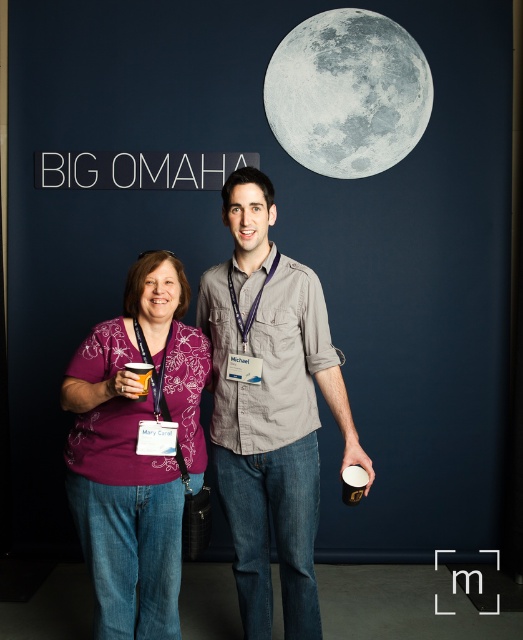
Which is below, gray cotton shirt at center or orange paper cup at lower left?

gray cotton shirt at center

Between point (295, 291) and point (147, 371), which one is positioned behind?

Point (295, 291)

The image size is (523, 640). Find the location of `gray cotton shirt at center`. gray cotton shirt at center is located at coordinates (270, 408).

Which of these two, matte purple blouse at center or white glossy cup at lower center, stands taller?

Standing taller between the two is matte purple blouse at center.

Does matte purple blouse at center appear on the right side of white glossy cup at lower center?

In fact, matte purple blouse at center is to the left of white glossy cup at lower center.

This screenshot has height=640, width=523. Identify the location of matte purple blouse at center. (134, 451).

Looking at this image, who is higher up, gray cotton shirt at center or gray textured moon at upper right?

gray textured moon at upper right is higher up.

Can you confirm if gray cotton shirt at center is thinner than gray textured moon at upper right?

Correct, gray cotton shirt at center's width is less than gray textured moon at upper right's.

Is point (322, 332) less distant than point (301, 129)?

Yes, point (322, 332) is closer to viewer.

Locate an element on the screen. The width and height of the screenshot is (523, 640). gray cotton shirt at center is located at coordinates [270, 408].